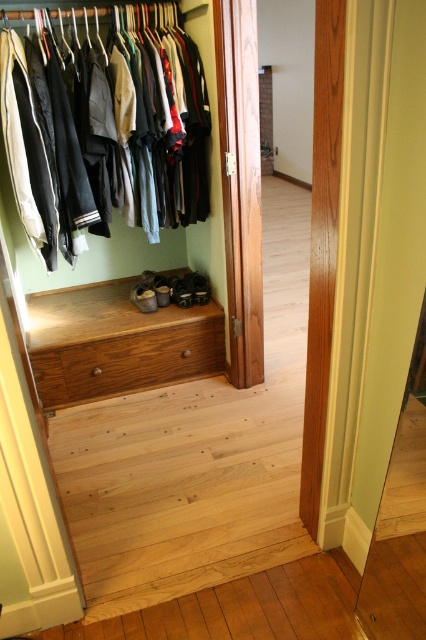
Is wooden drawer at center to the right of matte black shoe at center from the viewer's perspective?

Incorrect, wooden drawer at center is not on the right side of matte black shoe at center.

Which is above, wooden drawer at center or matte black shoe at center?

matte black shoe at center

Which is in front, point (74, 316) or point (173, 276)?

Point (74, 316)

This screenshot has height=640, width=426. Find the location of `wooden drawer at center`. wooden drawer at center is located at coordinates 117,342.

Which is in front, point (187, 276) or point (173, 301)?

Positioned in front is point (173, 301).

Can you confirm if matte brown shoe at center is positioned to the right of matte black shoe at center?

Correct, you'll find matte brown shoe at center to the right of matte black shoe at center.

Which is in front, point (198, 300) or point (192, 301)?

Point (192, 301)

At what (x,y) coordinates should I click in order to perform the action: click on matte brown shoe at center. Please return your answer as a coordinate pair (x, y). This screenshot has height=640, width=426. Looking at the image, I should click on (198, 288).

How distant is wooden drawer at center from matte black shoes at center?

wooden drawer at center is 20.68 centimeters from matte black shoes at center.

Which is in front, point (60, 292) or point (178, 276)?

Point (178, 276) is more forward.

I want to click on wooden drawer at center, so click(117, 342).